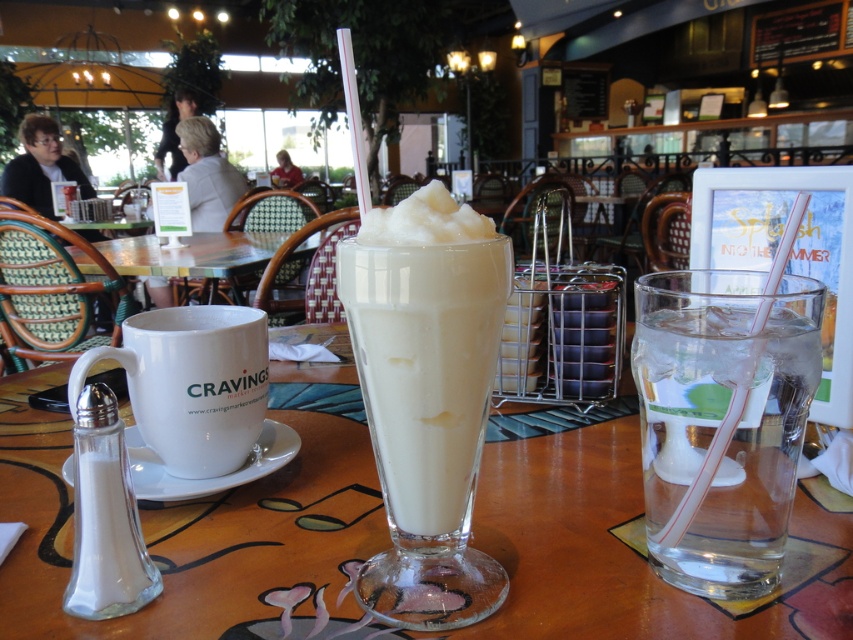
You are a customer at the cozy cafe and want to place your phone on the table. The transparent glass at center is in the way. Can you move the white frothy milkshake at center to the right to make space?

The transparent glass at center is to the left of the white frothy milkshake at center, so moving the milkshake to the right would move it away from the glass, creating space on the left side of the table. However, the question mentions moving the milkshake to the right to make space, but since the glass is already to the left of the milkshake, moving it further right would free up space to the left of the milkshake but not necessarily where the phone needs to be placed. Alternatively, moving the glass to

You are standing at the entrance of the cafe and want to order a drink. The barista points to the menu located at point [387,536]. Which object is at that location?

The transparent glass at center is located at point [387,536].

Please describe the location of the clear glass water at right in terms of coordinates within the image. The coordinate system has the origin at the bottom left corner of the image, with x and y axes increasing to the right and up respectively. The maximum x and y values are both 1.0. The answer should be in the format of a point with two decimal places, like 0.50,0.50.

The clear glass water at right is located at coordinates (722,420).